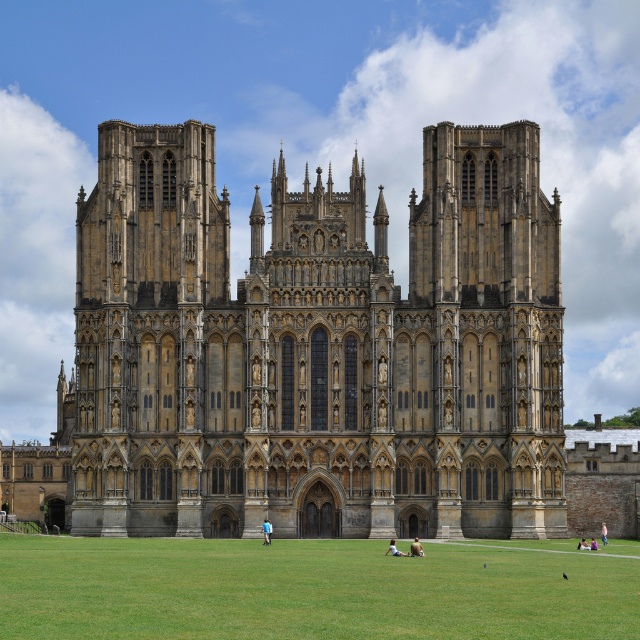
Question: Which object appears closest to the camera in this image?

Choices:
 (A) light blue denim jeans at center
 (B) light brown leather bag at center
 (C) green grass at lower center
 (D) light brown leather jacket at lower center

Answer: (C)

Question: Can you confirm if light brown leather jacket at lower center is thinner than blue fabric person at lower center?

Choices:
 (A) yes
 (B) no

Answer: (B)

Question: Which of the following is the farthest from the observer?

Choices:
 (A) green grass at lower center
 (B) light blue denim jeans at center
 (C) light brown leather jacket at lower center
 (D) light brown leather bag at center

Answer: (D)

Question: Estimate the real-world distances between objects in this image. Which object is farther from the green grass at lower center?

Choices:
 (A) blue fabric person at lower center
 (B) pink fabric at center
 (C) light blue denim jeans at center
 (D) light brown leather bag at center

Answer: (B)

Question: In this image, where is light brown leather jacket at lower center located relative to light brown hair at center?

Choices:
 (A) above
 (B) below

Answer: (B)

Question: Does yellow stone church at center have a lesser width compared to light brown leather bag at center?

Choices:
 (A) no
 (B) yes

Answer: (A)